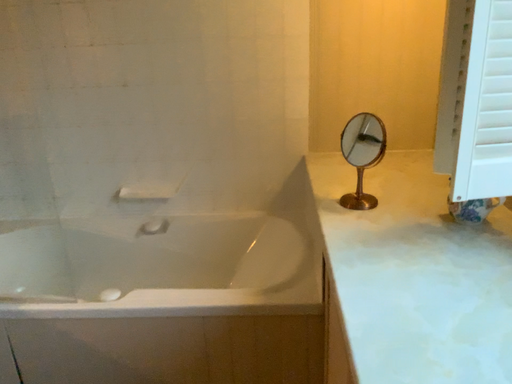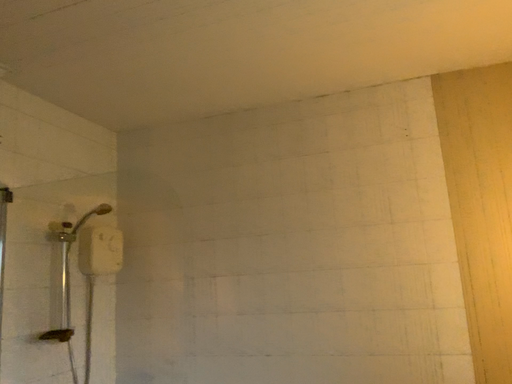
Question: Which way did the camera rotate in the video?

Choices:
 (A) rotated downward
 (B) rotated upward

Answer: (B)